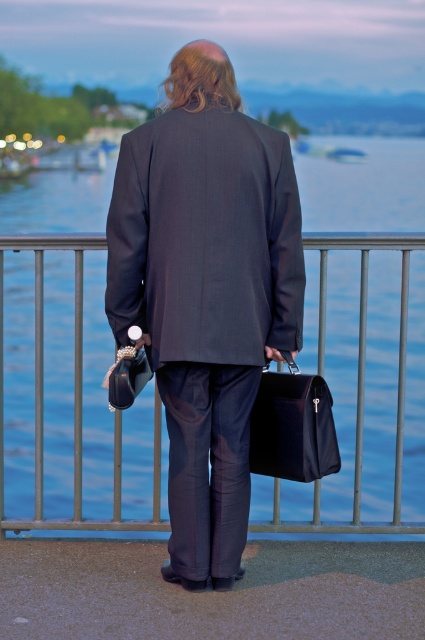
Question: Estimate the real-world distances between objects in this image. Which object is farther from the dark gray pinstripe suit at center?

Choices:
 (A) leather textured handbag at lower center
 (B) blue water at center
 (C) matte black briefcase at center

Answer: (B)

Question: Is blue water at center wider than matte black briefcase at center?

Choices:
 (A) yes
 (B) no

Answer: (A)

Question: Among these objects, which one is farthest from the camera?

Choices:
 (A) leather textured handbag at lower center
 (B) blue water at center
 (C) dark gray pinstripe suit at center
 (D) matte black briefcase at center

Answer: (B)

Question: Which point is farther from the camera taking this photo?

Choices:
 (A) (370, 515)
 (B) (198, 284)

Answer: (A)

Question: Where is blue water at center located in relation to dark gray pinstripe suit at center in the image?

Choices:
 (A) above
 (B) below

Answer: (A)

Question: Does matte black briefcase at center have a larger size compared to leather textured handbag at lower center?

Choices:
 (A) no
 (B) yes

Answer: (B)